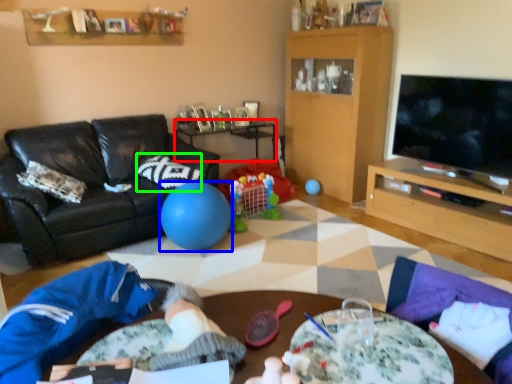
Question: Which is farther away from table (highlighted by a red box)? ball (highlighted by a blue box) or pillow (highlighted by a green box)?

Choices:
 (A) ball
 (B) pillow

Answer: (A)